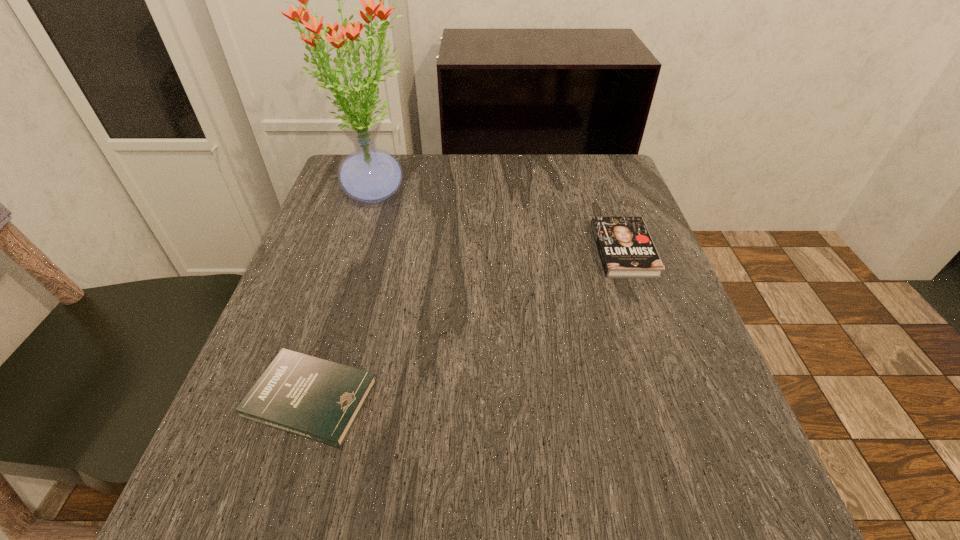
Locate an element on the screen. the farthest object is located at coordinates (369, 174).

In order to click on the tallest object in this screenshot , I will do `click(369, 174)`.

I want to click on the rightmost object, so click(x=626, y=250).

This screenshot has width=960, height=540. I want to click on the second nearest object, so click(626, 250).

Identify the location of the nearer book. (317, 399).

Find the location of a particular element. This screenshot has height=540, width=960. the left book is located at coordinates (317, 399).

Find the location of a particular element. This screenshot has height=540, width=960. vacant space situated on the right of the farthest object is located at coordinates (559, 191).

Locate an element on the screen. This screenshot has width=960, height=540. free location located 0.330m on the left of the farther book is located at coordinates (440, 250).

Find the location of a particular element. The height and width of the screenshot is (540, 960). free spot located on the back of the left book is located at coordinates (355, 256).

Image resolution: width=960 pixels, height=540 pixels. In order to click on object at the far edge in this screenshot , I will do point(369,174).